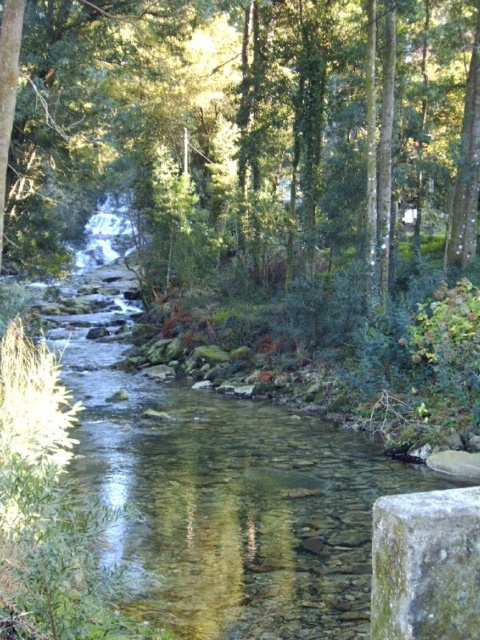
Question: Which of the following is the closest to the observer?

Choices:
 (A) clear water stream at center
 (B) green mossy stone at lower right
 (C) green leafy tree at center

Answer: (B)

Question: Among these points, which one is farthest from the camera?

Choices:
 (A) (250, 595)
 (B) (455, 576)
 (C) (344, 230)

Answer: (C)

Question: Can you confirm if green leafy tree at center is bigger than clear water stream at center?

Choices:
 (A) no
 (B) yes

Answer: (A)

Question: Among these objects, which one is nearest to the camera?

Choices:
 (A) green leafy tree at center
 (B) green mossy stone at lower right

Answer: (B)

Question: Does green leafy tree at center appear over green mossy stone at lower right?

Choices:
 (A) yes
 (B) no

Answer: (A)

Question: Is clear water stream at center closer to the viewer compared to green mossy stone at lower right?

Choices:
 (A) yes
 (B) no

Answer: (B)